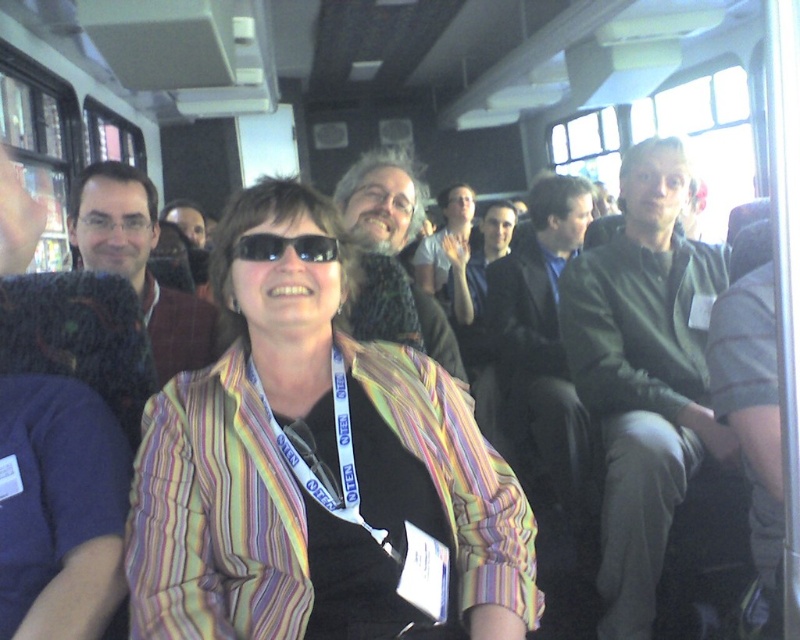
Question: Which point appears closest to the camera in this image?

Choices:
 (A) (694, 243)
 (B) (546, 378)
 (C) (348, 387)
 (D) (384, 547)

Answer: (D)

Question: Considering the relative positions of striped fabric jacket at center and black plastic sunglasses at center in the image provided, where is striped fabric jacket at center located with respect to black plastic sunglasses at center?

Choices:
 (A) left
 (B) right

Answer: (B)

Question: Which of these objects is positioned closest to the matte black camera at center?

Choices:
 (A) matte brown sweater at left
 (B) black plastic sunglasses at center
 (C) striped fabric jacket at center

Answer: (B)

Question: Does blue fabric lanyard at center have a lesser width compared to black plastic sunglasses at center?

Choices:
 (A) no
 (B) yes

Answer: (A)

Question: Which point is farther to the camera?

Choices:
 (A) (610, 598)
 (B) (340, 481)
 (C) (286, 627)
 (D) (405, 209)

Answer: (D)

Question: Is green cotton shirt at right further to camera compared to matte black camera at center?

Choices:
 (A) no
 (B) yes

Answer: (B)